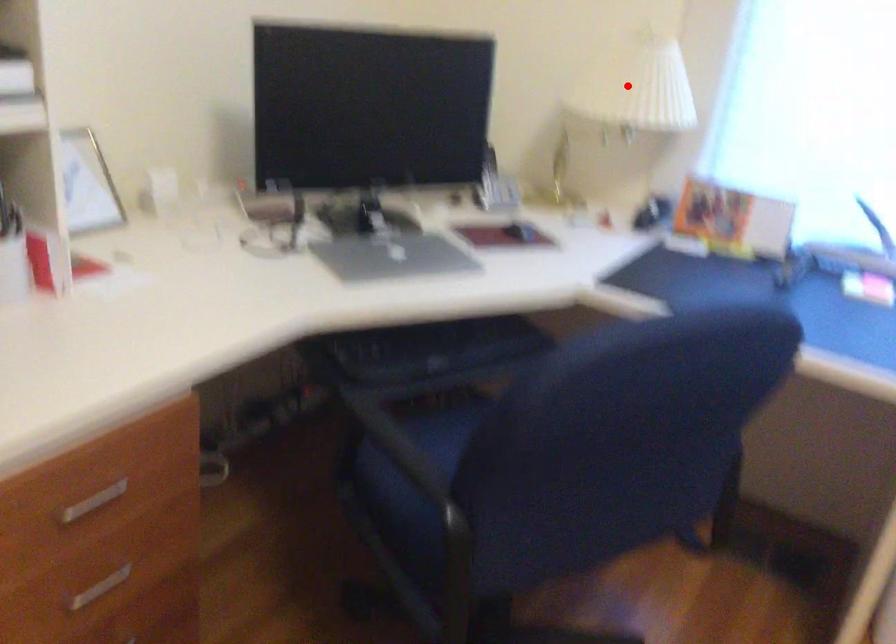
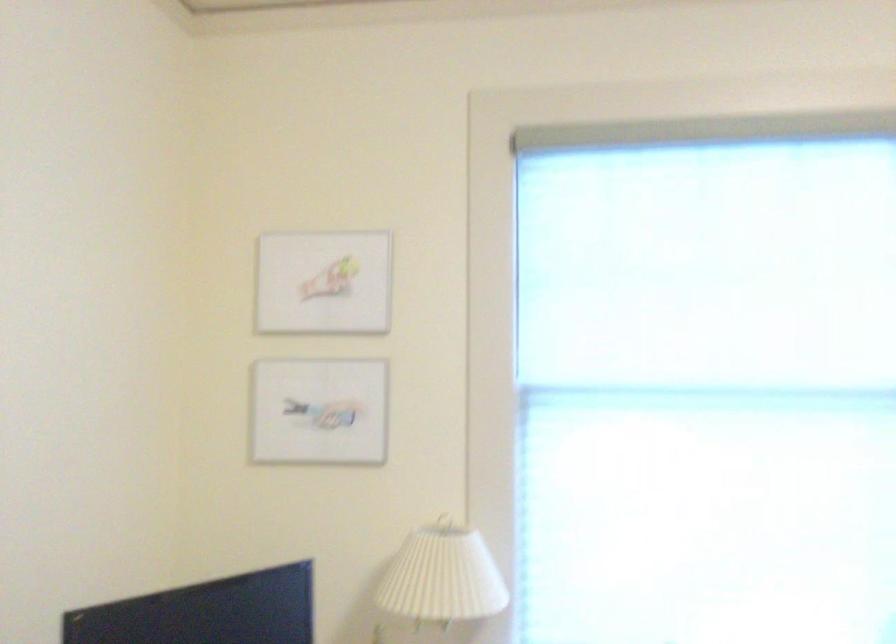
Question: I am providing you with two images of the same scene from different viewpoints. A red point is marked on the first image. At the location where the point appears in image 1, is it still visible in image 2?

Choices:
 (A) Yes
 (B) No

Answer: (A)